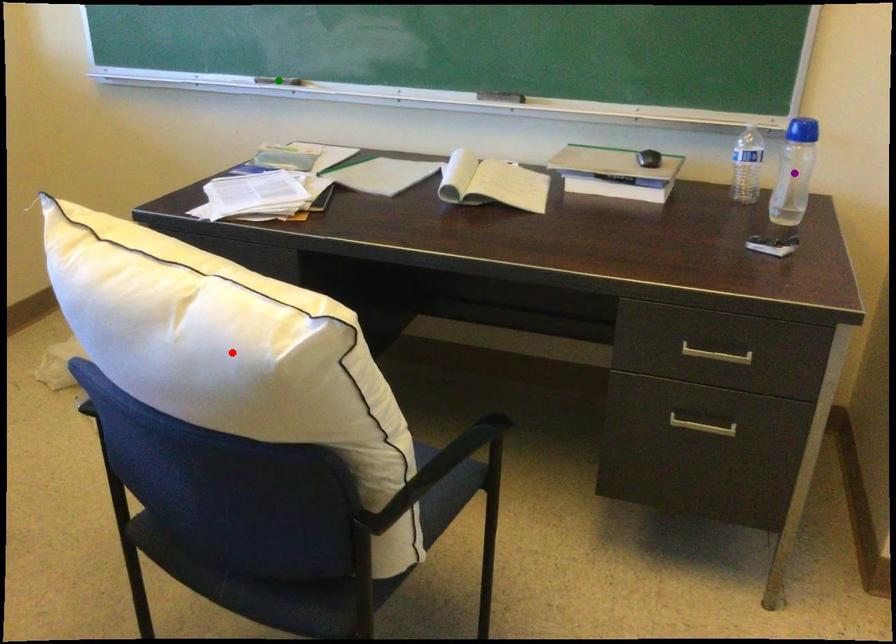
Order these from nearest to farthest:
1. red point
2. green point
3. purple point

1. red point
2. purple point
3. green point